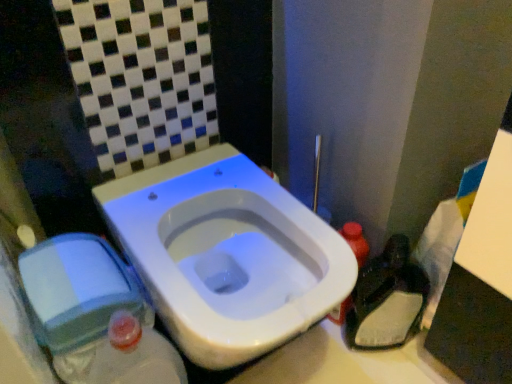
Question: Based on their positions, is dark plastic bag at lower right located to the left or right of white glossy toilet at center?

Choices:
 (A) right
 (B) left

Answer: (A)

Question: Is dark plastic bag at lower right in front of or behind white glossy toilet at center in the image?

Choices:
 (A) front
 (B) behind

Answer: (B)

Question: Estimate the real-world distances between objects in this image. Which object is closer to the translucent plastic bottle at right?

Choices:
 (A) white glossy toilet at center
 (B) dark plastic bag at lower right

Answer: (B)

Question: Which is farther from the dark plastic bag at lower right?

Choices:
 (A) white glossy toilet at center
 (B) translucent plastic bottle at right

Answer: (A)